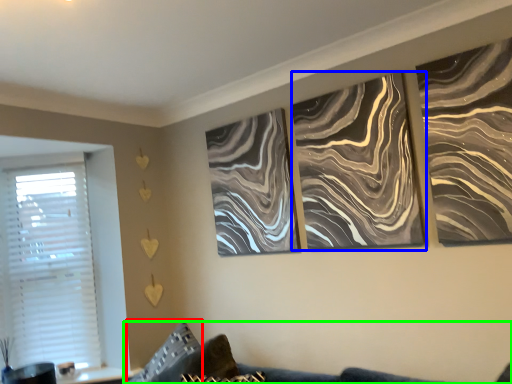
Question: Which object is positioned farthest from pillow (highlighted by a red box)? Select from canvas (highlighted by a blue box) and couch (highlighted by a green box).

Choices:
 (A) canvas
 (B) couch

Answer: (A)